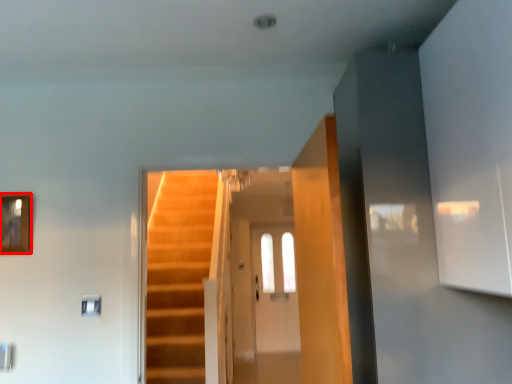
Question: In this image, where is picture frame (annotated by the red box) located relative to glass door?

Choices:
 (A) left
 (B) right

Answer: (A)